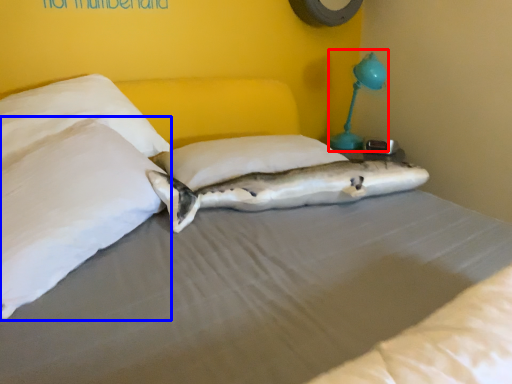
Question: Among these objects, which one is nearest to the camera, table lamp (highlighted by a red box) or pillow (highlighted by a blue box)?

Choices:
 (A) table lamp
 (B) pillow

Answer: (B)